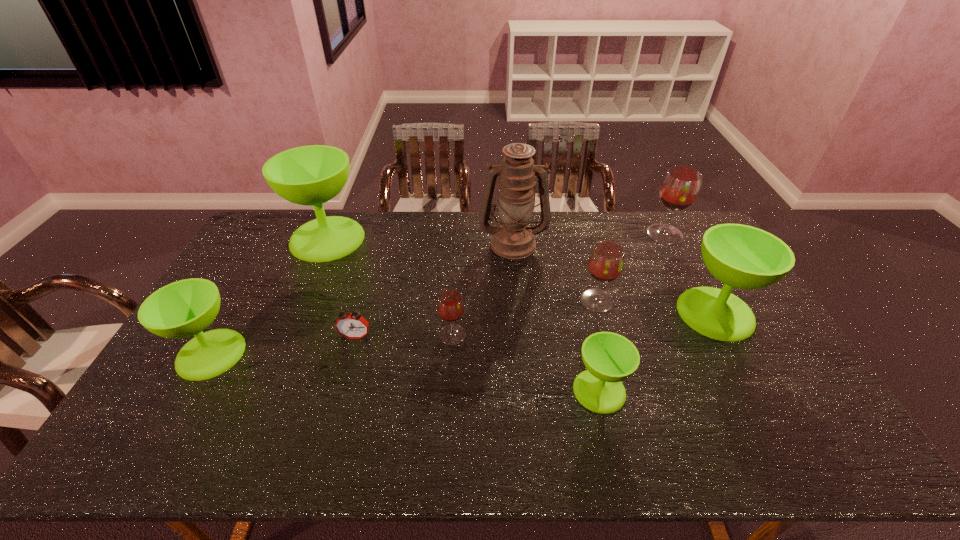
The width and height of the screenshot is (960, 540). Identify the location of free space located 0.140m on the front of the fifth wineglass from right to left. (449, 387).

Identify the location of free location located 0.290m on the back of the second green wineglass from right to left. This screenshot has width=960, height=540. (577, 295).

Locate an element on the screen. This screenshot has height=540, width=960. vacant space situated 0.090m on the clock face of the alarm clock is located at coordinates (348, 368).

Identify the location of oil lamp positioned at the far edge. (513, 238).

Locate an element on the screen. object located at the far left corner is located at coordinates (311, 175).

At what (x,y) coordinates should I click in order to perform the action: click on object that is at the far right corner. Please return your answer as a coordinate pair (x, y). Looking at the image, I should click on (680, 187).

The width and height of the screenshot is (960, 540). I want to click on vacant space at the far edge, so click(x=653, y=214).

This screenshot has height=540, width=960. In the image, there is a desktop. Identify the location of blank space at the near edge. (692, 438).

Locate an element on the screen. Image resolution: width=960 pixels, height=540 pixels. vacant space at the far left corner of the desktop is located at coordinates (270, 245).

In order to click on empty space between the sixth object from right to left and the biggest red wineglass in this screenshot , I will do `click(559, 285)`.